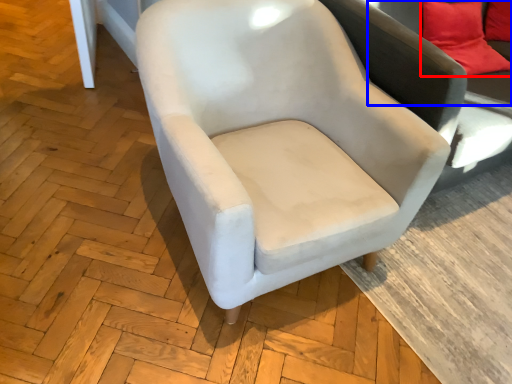
Question: Which object is closer to the camera taking this photo, pillow (highlighted by a red box) or couch (highlighted by a blue box)?

Choices:
 (A) pillow
 (B) couch

Answer: (B)